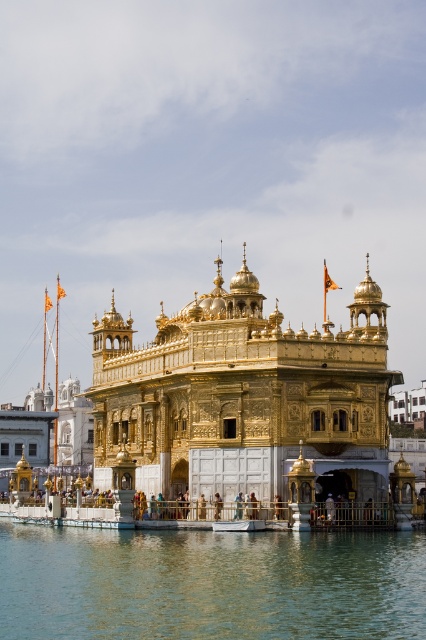
Question: Among these points, which one is nearest to the camera?

Choices:
 (A) (54, 637)
 (B) (241, 492)
 (C) (120, 360)
 (D) (216, 512)

Answer: (A)

Question: Is clear water at lower center closer to the viewer compared to golden ornate temple at center?

Choices:
 (A) no
 (B) yes

Answer: (B)

Question: Can you confirm if clear water at lower center is bigger than blue fabric person at center?

Choices:
 (A) no
 (B) yes

Answer: (B)

Question: Which object appears closest to the camera in this image?

Choices:
 (A) gold/gilded temple at center
 (B) clear water at lower center
 (C) blue fabric person at center
 (D) golden ornate temple at center

Answer: (B)

Question: Does clear water at lower center appear under blue fabric person at center?

Choices:
 (A) yes
 (B) no

Answer: (A)

Question: Which object is farther from the camera taking this photo?

Choices:
 (A) blue fabric person at center
 (B) golden ornate temple at center
 (C) clear water at lower center

Answer: (B)